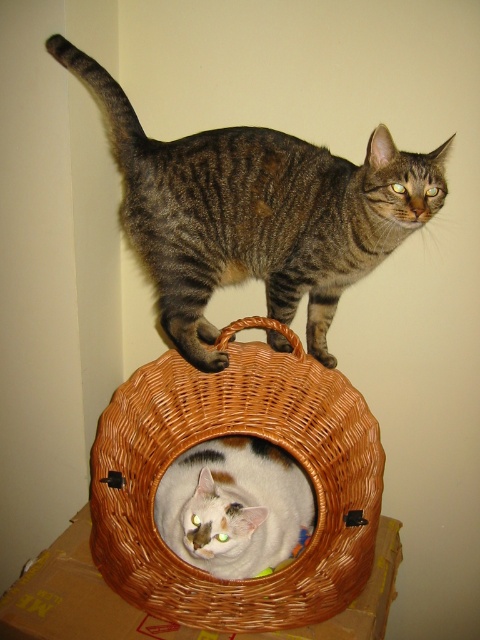
You are a photographer trying to capture a photo of the woven brown basket at center. You want to ensure the basket is perfectly centered in your shot. Based on the coordinates provided, what are the coordinates you should aim for to center the basket?

The coordinates you should aim for to center the basket are exactly at point (241, 433), as this is the 2D location of the woven brown basket at center.

You are a cat owner trying to place a new toy in the basket where the cats are. The toy has a diameter of 15 cm. The point at coordinate (241, 433) marks the center of the woven brown basket at center. The basket has a diameter of 30 cm. Can the toy fit inside the basket?

The woven brown basket at center has a diameter of 30 cm. The toy has a diameter of 15 cm, which is half the size of the basket. Therefore, the toy can fit inside the basket.

You are a cat owner trying to locate your two cats in the living room. You see the tabby fur cat at upper center and the white fur cat at center. Which cat is closer to you?

The tabby fur cat at upper center is closer to you because the white fur cat at center is behind it.